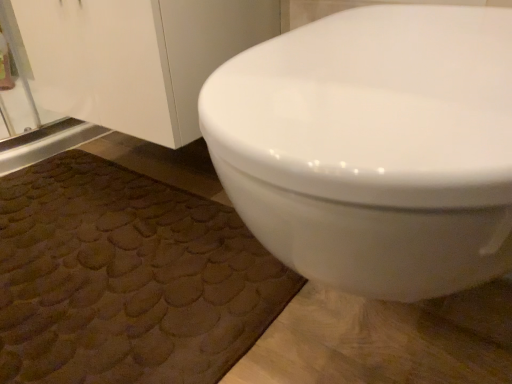
Question: Could you tell me if brown textured bath mat at lower left is facing white glossy toilet at upper right?

Choices:
 (A) yes
 (B) no

Answer: (B)

Question: Is brown textured bath mat at lower left taller than white glossy toilet at upper right?

Choices:
 (A) no
 (B) yes

Answer: (A)

Question: Is brown textured bath mat at lower left positioned before white glossy toilet at upper right?

Choices:
 (A) yes
 (B) no

Answer: (B)

Question: From the image's perspective, is brown textured bath mat at lower left below white glossy toilet at upper right?

Choices:
 (A) no
 (B) yes

Answer: (B)

Question: Can you confirm if brown textured bath mat at lower left is positioned to the right of white glossy toilet at upper right?

Choices:
 (A) no
 (B) yes

Answer: (A)

Question: Considering the relative sizes of brown textured bath mat at lower left and white glossy toilet at upper right in the image provided, is brown textured bath mat at lower left thinner than white glossy toilet at upper right?

Choices:
 (A) yes
 (B) no

Answer: (B)

Question: Are white glossy toilet at upper right and brown textured bath mat at lower left making contact?

Choices:
 (A) yes
 (B) no

Answer: (B)

Question: Is white glossy toilet at upper right far from brown textured bath mat at lower left?

Choices:
 (A) no
 (B) yes

Answer: (A)

Question: Is white glossy toilet at upper right outside brown textured bath mat at lower left?

Choices:
 (A) no
 (B) yes

Answer: (B)

Question: Can you confirm if white glossy toilet at upper right is smaller than brown textured bath mat at lower left?

Choices:
 (A) no
 (B) yes

Answer: (A)

Question: From a real-world perspective, is white glossy toilet at upper right below brown textured bath mat at lower left?

Choices:
 (A) yes
 (B) no

Answer: (B)

Question: Does white glossy toilet at upper right have a lesser height compared to brown textured bath mat at lower left?

Choices:
 (A) yes
 (B) no

Answer: (B)

Question: From the image's perspective, is white glossy toilet at upper right above or below brown textured bath mat at lower left?

Choices:
 (A) above
 (B) below

Answer: (A)